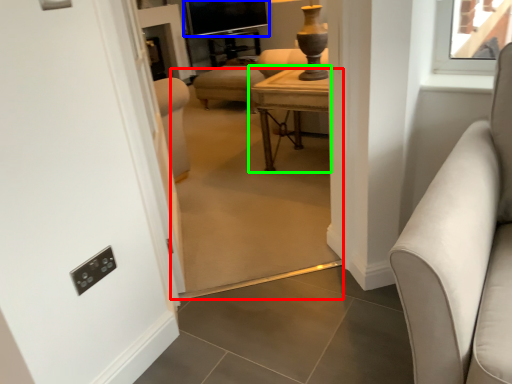
Question: Estimate the real-world distances between objects in this image. Which object is farther from plain (highlighted by a red box), window screen (highlighted by a blue box) or table (highlighted by a green box)?

Choices:
 (A) window screen
 (B) table

Answer: (A)